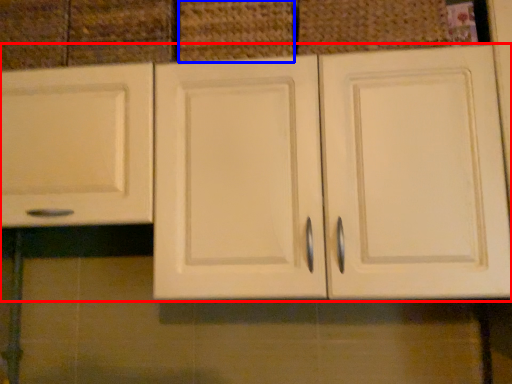
Question: Which of the following is the farthest to the observer, cabinetry (highlighted by a red box) or basket (highlighted by a blue box)?

Choices:
 (A) cabinetry
 (B) basket

Answer: (B)